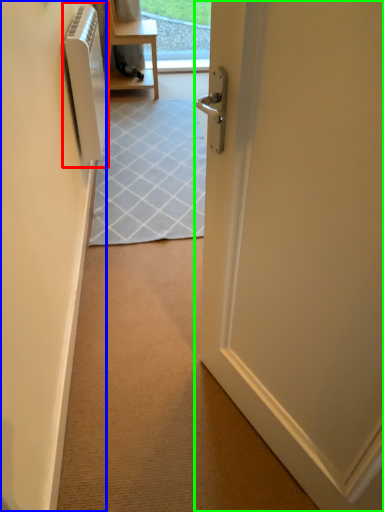
Question: Considering the real-world distances, which object is closest to air conditioner (highlighted by a red box)? screen door (highlighted by a blue box) or door (highlighted by a green box).

Choices:
 (A) screen door
 (B) door

Answer: (A)